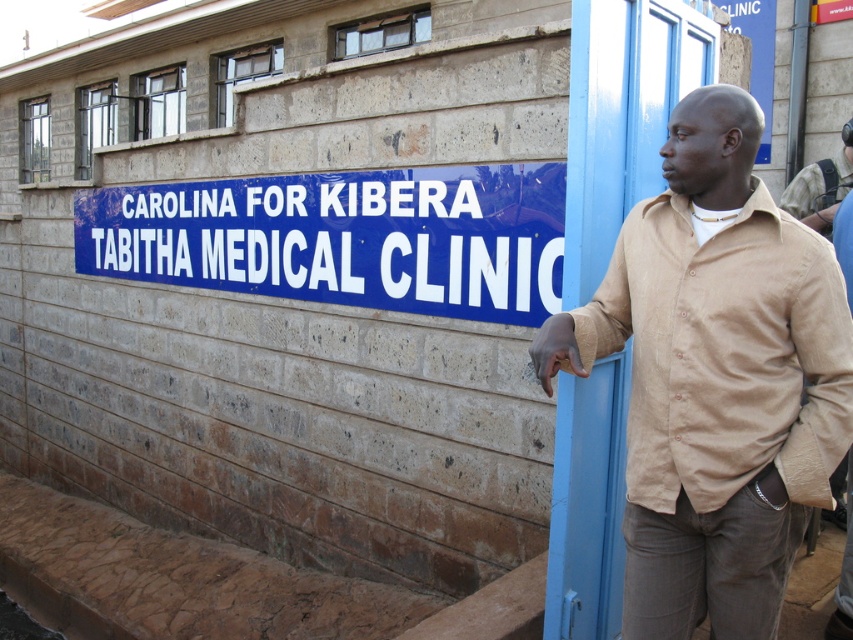
Question: Is blue plastic sign at center above beige cotton shirt at upper right?

Choices:
 (A) no
 (B) yes

Answer: (A)

Question: Is beige cotton shirt at center positioned at the back of beige cotton shirt at upper right?

Choices:
 (A) yes
 (B) no

Answer: (B)

Question: Which point is farther to the camera?

Choices:
 (A) beige cotton shirt at upper right
 (B) blue plastic sign at center

Answer: (A)

Question: Estimate the real-world distances between objects in this image. Which object is farther from the beige cotton shirt at center?

Choices:
 (A) blue plastic sign at center
 (B) beige cotton shirt at upper right

Answer: (B)

Question: Which is nearer to the blue plastic sign at center?

Choices:
 (A) beige cotton shirt at upper right
 (B) beige cotton shirt at center

Answer: (B)

Question: Can you confirm if beige cotton shirt at center is positioned to the left of beige cotton shirt at upper right?

Choices:
 (A) yes
 (B) no

Answer: (A)